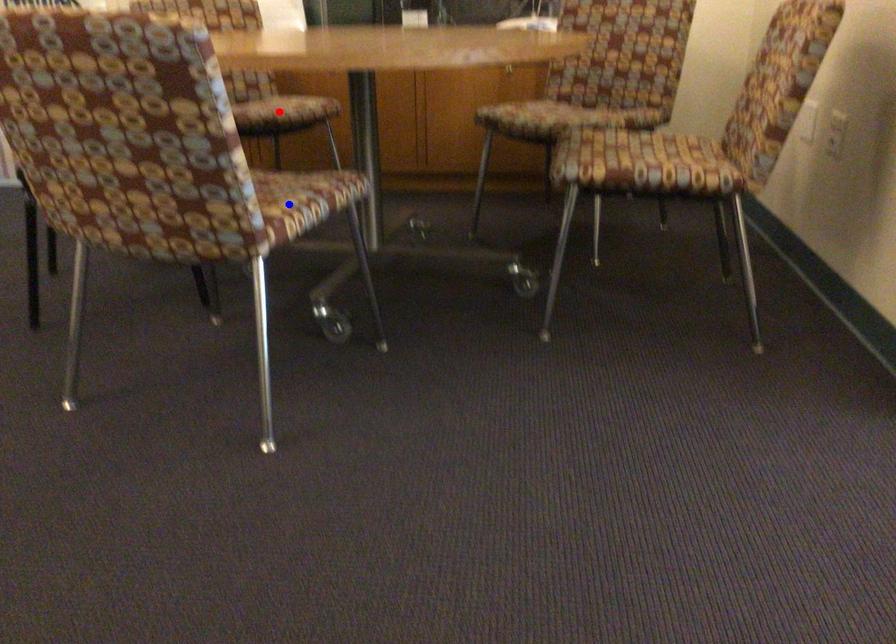
Question: Which of the two points in the image is closer to the camera?

Choices:
 (A) Blue point is closer.
 (B) Red point is closer.

Answer: (A)